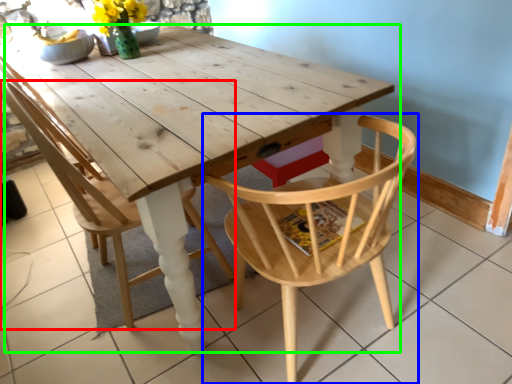
Question: Estimate the real-world distances between objects in this image. Which object is farther from chair (highlighted by a red box), chair (highlighted by a blue box) or table (highlighted by a green box)?

Choices:
 (A) chair
 (B) table

Answer: (A)